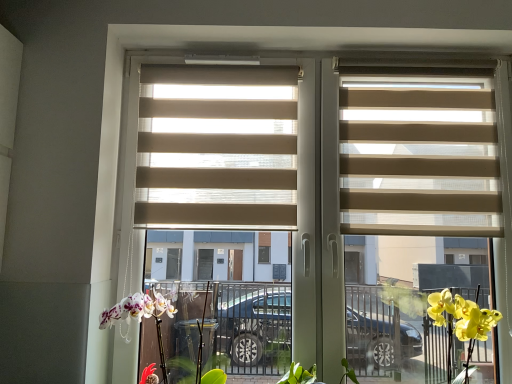
Question: Is beige fabric blinds at center oriented towards beige fabric blinds at right, placed as the second window blind when sorted from left to right?

Choices:
 (A) no
 (B) yes

Answer: (B)

Question: Is beige fabric blinds at center next to beige fabric blinds at right, placed as the second window blind when sorted from left to right?

Choices:
 (A) no
 (B) yes

Answer: (A)

Question: Is beige fabric blinds at center behind beige fabric blinds at right, marked as the first window blind in a right-to-left arrangement?

Choices:
 (A) no
 (B) yes

Answer: (A)

Question: Does beige fabric blinds at center have a lesser height compared to beige fabric blinds at right, placed as the second window blind when sorted from left to right?

Choices:
 (A) yes
 (B) no

Answer: (B)

Question: Is there a large distance between beige fabric blinds at center and beige fabric blinds at right, placed as the second window blind when sorted from left to right?

Choices:
 (A) yes
 (B) no

Answer: (B)

Question: Based on their sizes in the image, would you say beige fabric blinds at right, placed as the second window blind when sorted from left to right, is bigger or smaller than white matte orchid at lower left?

Choices:
 (A) big
 (B) small

Answer: (B)

Question: Is beige fabric blinds at right, marked as the first window blind in a right-to-left arrangement, wider or thinner than white matte orchid at lower left?

Choices:
 (A) thin
 (B) wide

Answer: (A)

Question: Would you say beige fabric blinds at right, placed as the second window blind when sorted from left to right, is inside or outside white matte orchid at lower left?

Choices:
 (A) inside
 (B) outside

Answer: (B)

Question: Is beige fabric blinds at right, placed as the second window blind when sorted from left to right, taller or shorter than white matte orchid at lower left?

Choices:
 (A) tall
 (B) short

Answer: (A)

Question: From the image's perspective, relative to beige fabric blinds at right, marked as the first window blind in a right-to-left arrangement, is beige fabric blinds at center, the 2th window blind from the right, above or below?

Choices:
 (A) above
 (B) below

Answer: (A)

Question: From a real-world perspective, is beige fabric blinds at center, the 1th window blind viewed from the left, physically located above or below beige fabric blinds at right, placed as the second window blind when sorted from left to right?

Choices:
 (A) above
 (B) below

Answer: (A)

Question: Is beige fabric blinds at center, the 1th window blind viewed from the left, inside the boundaries of beige fabric blinds at right, marked as the first window blind in a right-to-left arrangement, or outside?

Choices:
 (A) outside
 (B) inside

Answer: (A)

Question: Considering the positions of beige fabric blinds at center, the 2th window blind from the right, and beige fabric blinds at right, placed as the second window blind when sorted from left to right, in the image, is beige fabric blinds at center, the 2th window blind from the right, taller or shorter than beige fabric blinds at right, placed as the second window blind when sorted from left to right,?

Choices:
 (A) tall
 (B) short

Answer: (B)

Question: Considering the positions of beige fabric blinds at center, the 2th window blind from the right, and beige fabric blinds at center in the image, is beige fabric blinds at center, the 2th window blind from the right, taller or shorter than beige fabric blinds at center?

Choices:
 (A) short
 (B) tall

Answer: (A)

Question: Is beige fabric blinds at center, the 1th window blind viewed from the left, in front of or behind beige fabric blinds at center in the image?

Choices:
 (A) behind
 (B) front

Answer: (A)